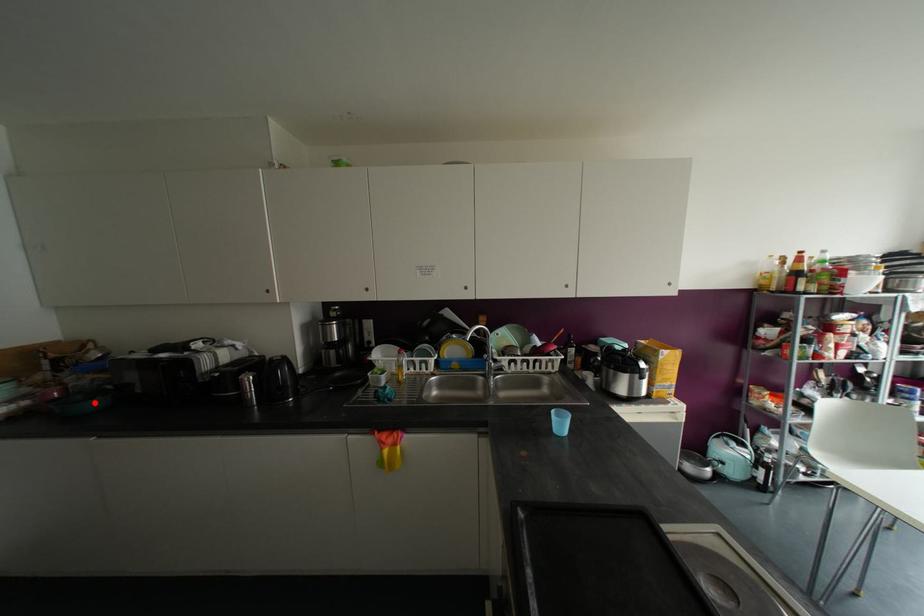
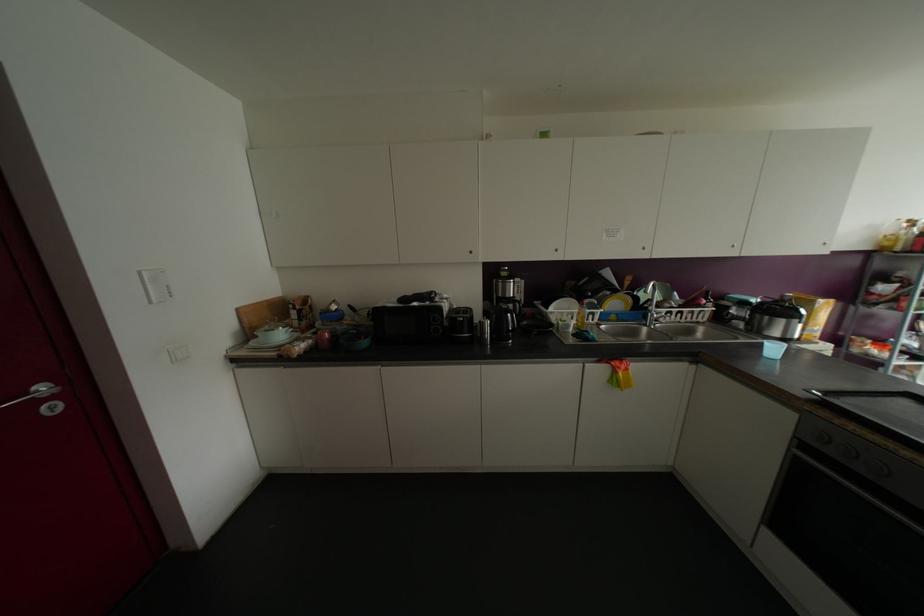
Question: A red point is marked in image1. In image2, is the corresponding 3D point closer to the camera or farther? Reply with the corresponding letter.

Choices:
 (A) The corresponding 3D point is closer.
 (B) The corresponding 3D point is farther.

Answer: (B)